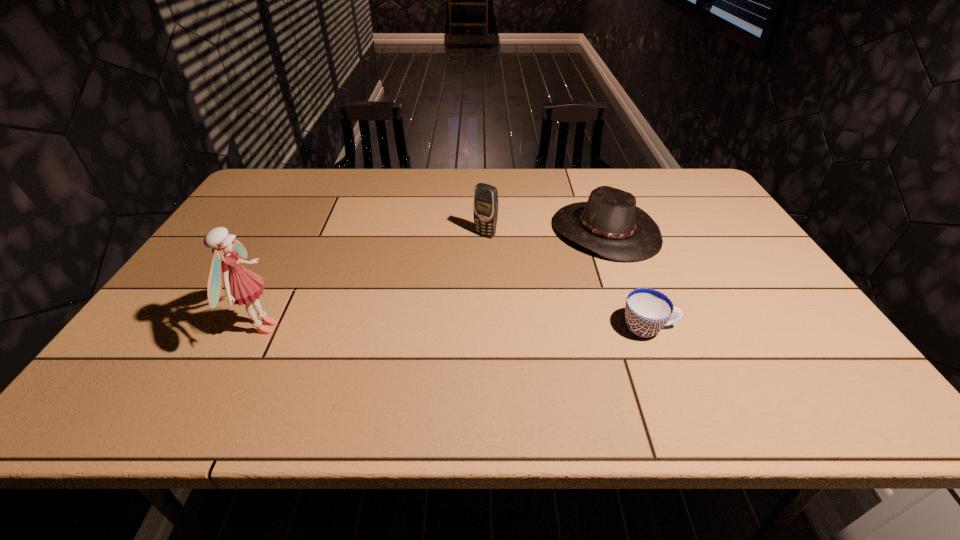
Find the location of `vacant space located 0.080m on the front face of the third object from right to left`. vacant space located 0.080m on the front face of the third object from right to left is located at coordinates (467, 254).

Find the location of `vacant space located on the front-facing side of the hat`. vacant space located on the front-facing side of the hat is located at coordinates (498, 322).

Where is `vacant area situated on the front-facing side of the hat`? The height and width of the screenshot is (540, 960). vacant area situated on the front-facing side of the hat is located at coordinates (485, 334).

This screenshot has width=960, height=540. In order to click on free space located 0.270m on the front-facing side of the hat in this screenshot , I will do `click(519, 305)`.

You are a GUI agent. You are given a task and a screenshot of the screen. Output one action in this format:
    pyautogui.click(x=<x>, y=<y>)
    Task: Click on the doll situated at the near edge
    The width and height of the screenshot is (960, 540).
    Given the screenshot: What is the action you would take?
    click(242, 286)

Image resolution: width=960 pixels, height=540 pixels. Find the location of `cup located in the near edge section of the desktop`. cup located in the near edge section of the desktop is located at coordinates (647, 311).

Where is `vacant space at the far edge`? This screenshot has width=960, height=540. vacant space at the far edge is located at coordinates (329, 184).

Where is `vacant area at the near edge of the desktop`? The width and height of the screenshot is (960, 540). vacant area at the near edge of the desktop is located at coordinates (228, 354).

Locate an element on the screen. Image resolution: width=960 pixels, height=540 pixels. vacant space at the left edge of the desktop is located at coordinates (239, 242).

Where is `vacant space at the far left corner of the desktop`? This screenshot has width=960, height=540. vacant space at the far left corner of the desktop is located at coordinates (297, 182).